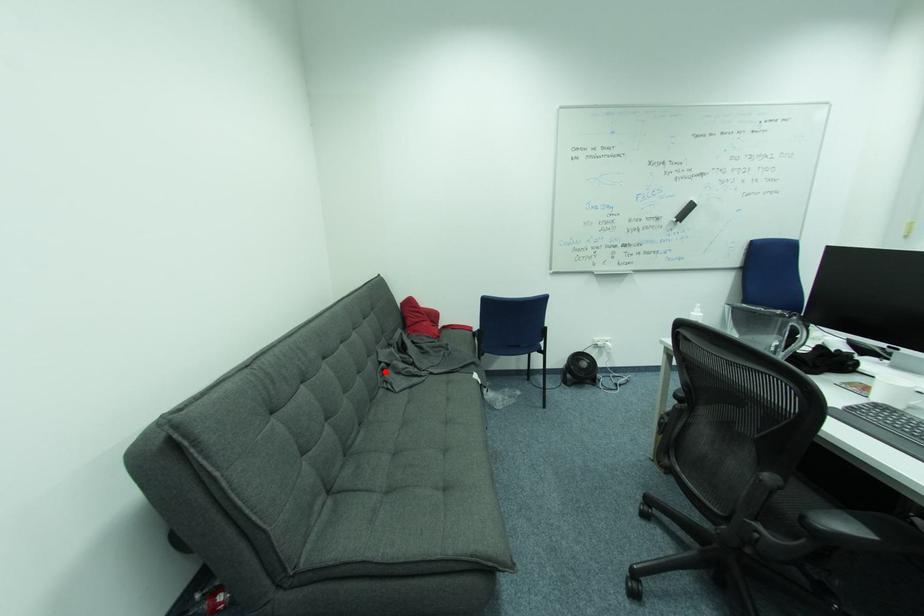
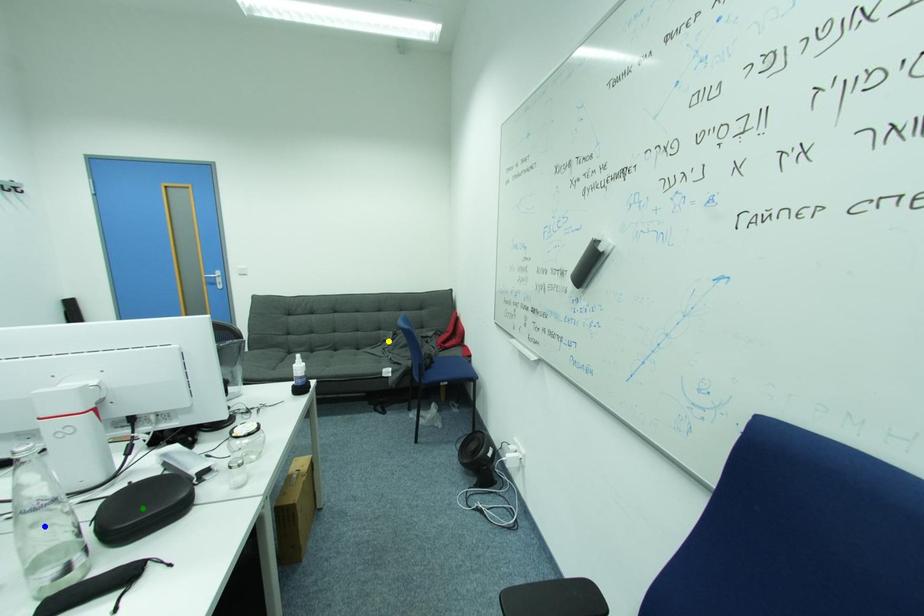
Question: I am providing you with two images of the same scene from different viewpoints. A red point is marked on the first image. You are given multiple points on the second image. Which spot in image 2 lines up with the point in image 1?

Choices:
 (A) blue point
 (B) yellow point
 (C) green point

Answer: (B)